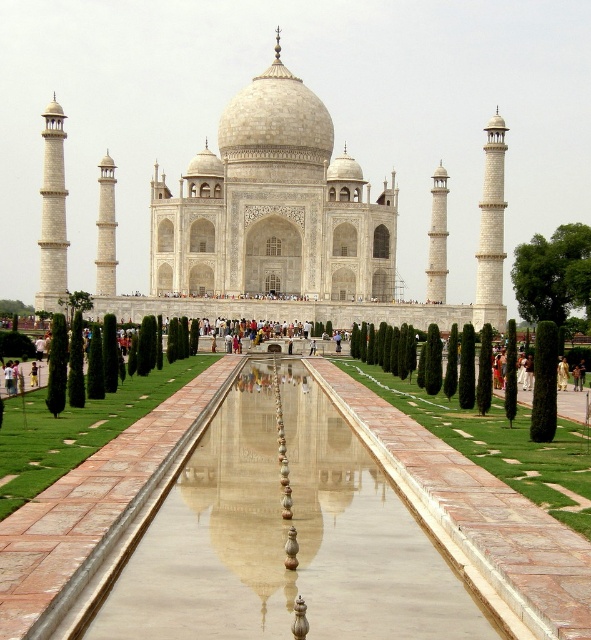
Is smooth stone water at center positioned in front of white marble taj mahal at center?

Yes, smooth stone water at center is closer to the viewer.

Which is in front, point (405, 586) or point (485, 173)?

Positioned in front is point (405, 586).

This screenshot has height=640, width=591. What are the coordinates of `smooth stone water at center` in the screenshot? It's located at (284, 538).

What are the coordinates of `smooth stone water at center` in the screenshot? It's located at (284, 538).